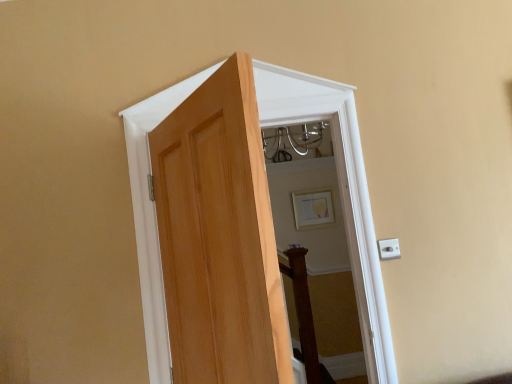
Question: Is white plastic electric outlet at right inside or outside of matte gold picture frame at upper center?

Choices:
 (A) outside
 (B) inside

Answer: (A)

Question: Is white plastic electric outlet at right taller or shorter than matte gold picture frame at upper center?

Choices:
 (A) tall
 (B) short

Answer: (B)

Question: Based on their relative distances, which object is nearer to the natural wood door at center?

Choices:
 (A) white plastic electric outlet at right
 (B) matte gold picture frame at upper center

Answer: (A)

Question: Which object is positioned closest to the matte gold picture frame at upper center?

Choices:
 (A) natural wood door at center
 (B) white plastic electric outlet at right

Answer: (A)